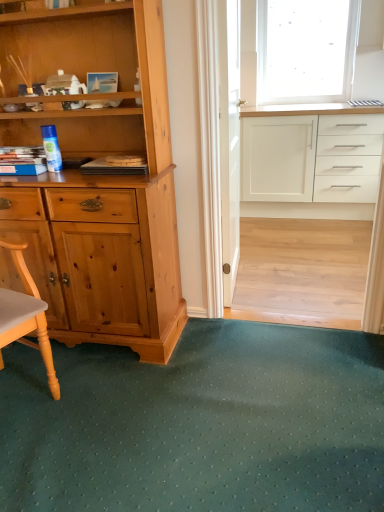
What are the coordinates of `vacant space to the right of clear glass screen door at center` in the screenshot? It's located at (301, 275).